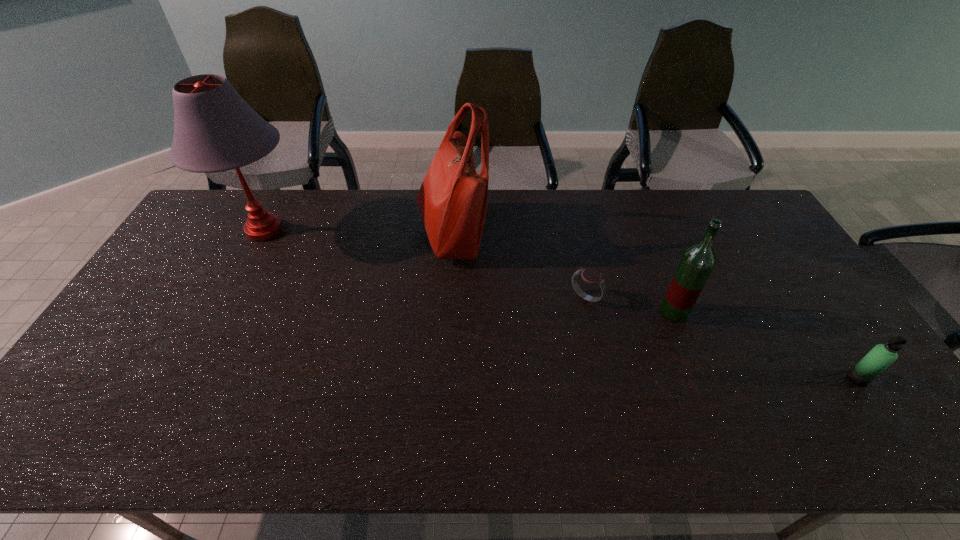
Where is `the leftmost object`? the leftmost object is located at coordinates (215, 129).

This screenshot has height=540, width=960. In order to click on handbag in this screenshot , I will do `click(452, 200)`.

Identify the location of liquor. (698, 261).

This screenshot has height=540, width=960. Find the location of `the fourth object from left to right`. the fourth object from left to right is located at coordinates (698, 261).

Locate an element on the screen. the nearest object is located at coordinates (881, 356).

Find the location of a particular element. the rightmost object is located at coordinates (881, 356).

Find the location of a particular element. watch is located at coordinates (591, 276).

This screenshot has width=960, height=540. I want to click on the third object from left to right, so click(591, 276).

Find the location of `vacant space situated on the front-facing side of the table lamp`. vacant space situated on the front-facing side of the table lamp is located at coordinates (407, 231).

Find the location of a particular element. This screenshot has width=960, height=540. vacant space located 0.370m on the front-facing side of the second object from left to right is located at coordinates (596, 234).